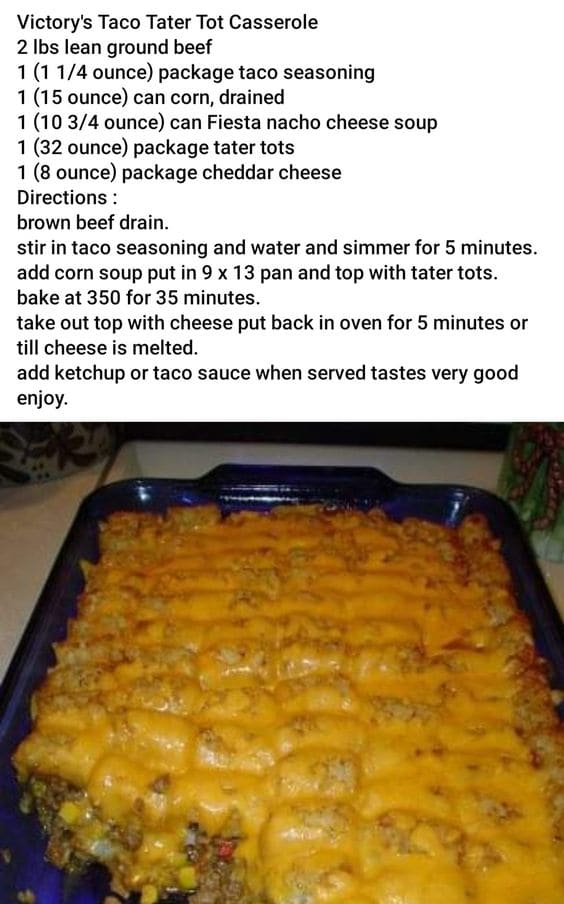
I want to click on blue rectangular ceramic casserole dish, so click(74, 575).